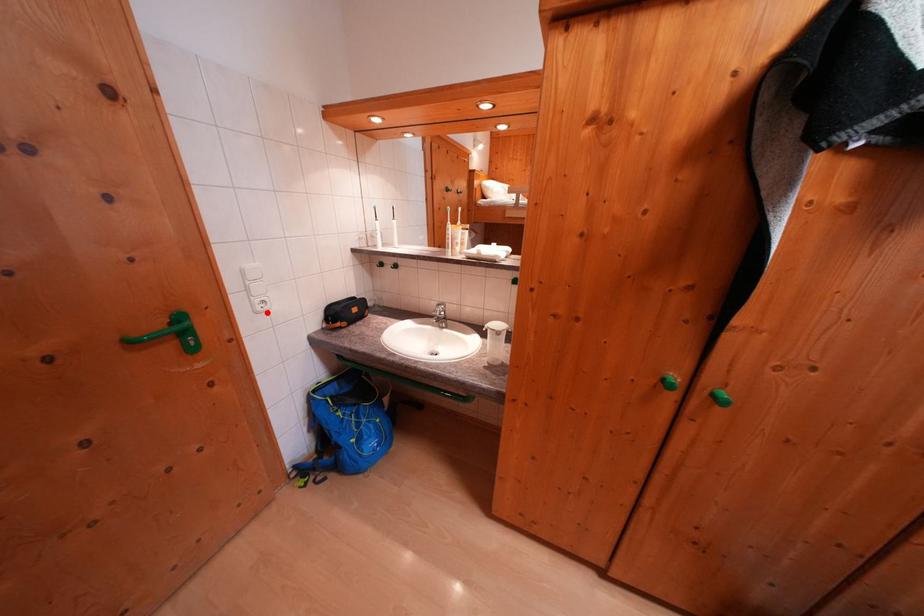
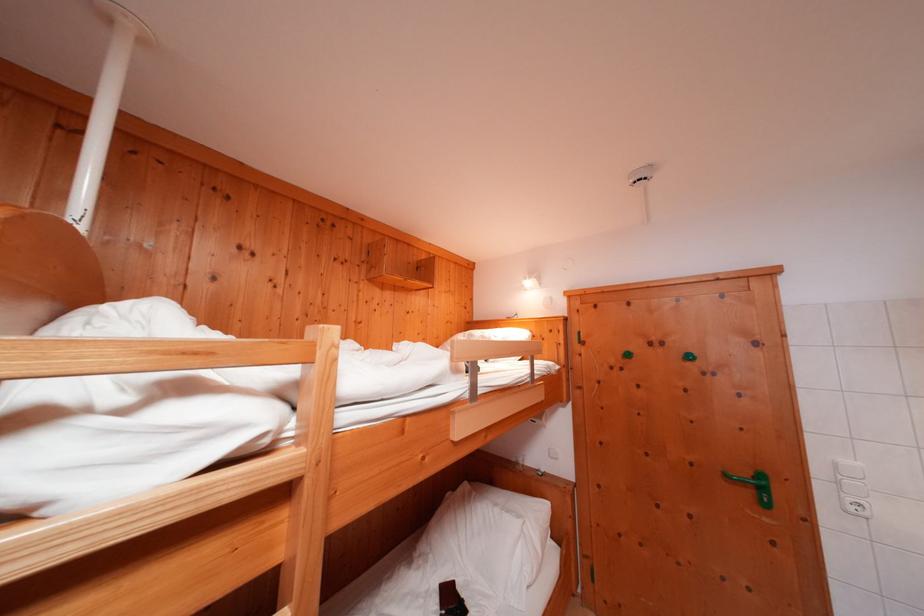
Where in the second image is the point corresponding to the highlighted location from the first image?

(858, 513)